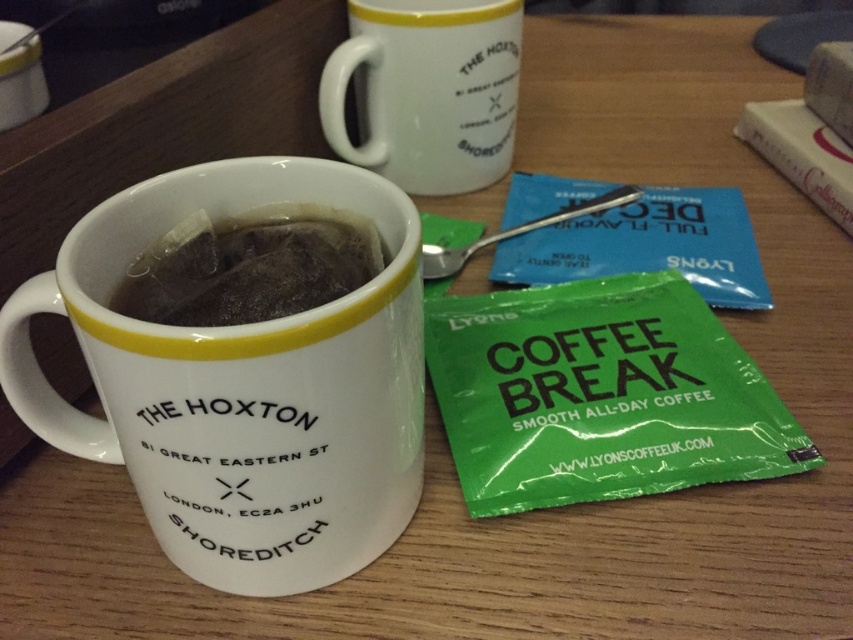
Does white glossy mug at center appear on the left side of black paper tea bag at center?

Indeed, white glossy mug at center is positioned on the left side of black paper tea bag at center.

Who is taller, white glossy mug at center or black paper tea bag at center?

With more height is white glossy mug at center.

Identify the location of white glossy mug at center. The height and width of the screenshot is (640, 853). (242, 385).

The height and width of the screenshot is (640, 853). What are the coordinates of `white glossy mug at center` in the screenshot? It's located at (242, 385).

From the picture: How distant is white glossy mug at upper center from black paper tea bag at center?

white glossy mug at upper center is 23.57 inches away from black paper tea bag at center.

Where is `white glossy mug at upper center`? This screenshot has width=853, height=640. white glossy mug at upper center is located at coordinates (427, 90).

Is the position of white glossy mug at center more distant than that of white glossy mug at upper center?

That is False.

Is white glossy mug at center smaller than white glossy mug at upper center?

Actually, white glossy mug at center might be larger than white glossy mug at upper center.

Find the location of a particular element. The image size is (853, 640). white glossy mug at center is located at coordinates (242, 385).

Identify the location of white glossy mug at center. (242, 385).